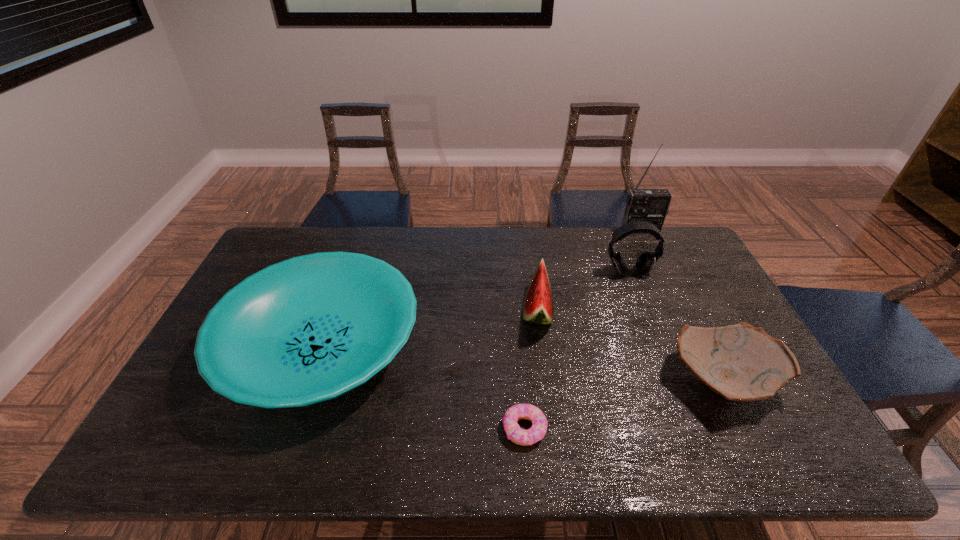
Locate an element on the screen. This screenshot has height=540, width=960. free space between the fifth nearest object and the shortest object is located at coordinates (577, 350).

This screenshot has height=540, width=960. What are the coordinates of `vacant region between the watermelon and the dish` in the screenshot? It's located at (430, 329).

This screenshot has height=540, width=960. What are the coordinates of `vacant area that lies between the shortest object and the fifth tallest object` in the screenshot? It's located at (623, 405).

Locate an element on the screen. Image resolution: width=960 pixels, height=540 pixels. vacant area that lies between the farthest object and the doughnut is located at coordinates (583, 330).

The height and width of the screenshot is (540, 960). Identify the location of empty space between the doughnut and the radio receiver. (583, 330).

This screenshot has width=960, height=540. What are the coordinates of `vacant point located between the doughnut and the watermelon` in the screenshot? It's located at (531, 370).

You are a GUI agent. You are given a task and a screenshot of the screen. Output one action in this format:
    pyautogui.click(x=<x>, y=<y>)
    Task: Click on the free point between the shortest object and the dish
    The image size is (960, 540).
    Given the screenshot: What is the action you would take?
    pyautogui.click(x=423, y=388)

Find the location of a particular element. vacant space in between the watermelon and the dish is located at coordinates (430, 329).

You are a GUI agent. You are given a task and a screenshot of the screen. Output one action in this format:
    pyautogui.click(x=<x>, y=<y>)
    Task: Click on the free space between the shortest object and the leftmost object
    
    Given the screenshot: What is the action you would take?
    pyautogui.click(x=423, y=388)

Select which object appears as the fourth closest to the dish. Please provide its 2D coordinates. Your answer should be formatted as a tuple, i.e. [(x, y)], where the tuple contains the x and y coordinates of a point satisfying the conditions above.

[(740, 362)]